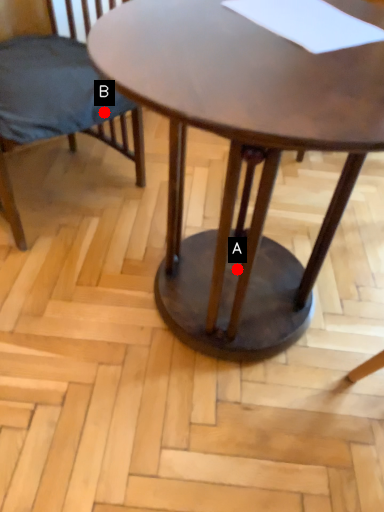
Question: Two points are circled on the image, labeled by A and B beside each circle. Which point is closer to the camera?

Choices:
 (A) A is closer
 (B) B is closer

Answer: (A)